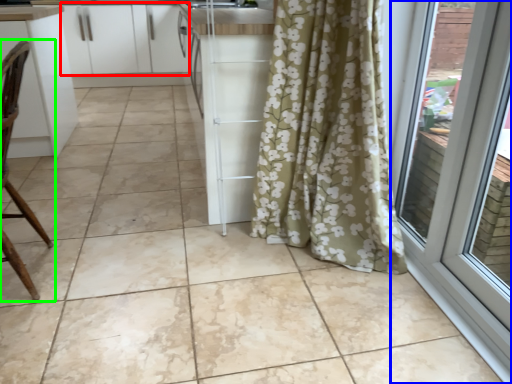
Question: Which object is positioned closest to cabinetry (highlighted by a red box)? Select from door (highlighted by a blue box) and chair (highlighted by a green box).

Choices:
 (A) door
 (B) chair

Answer: (B)